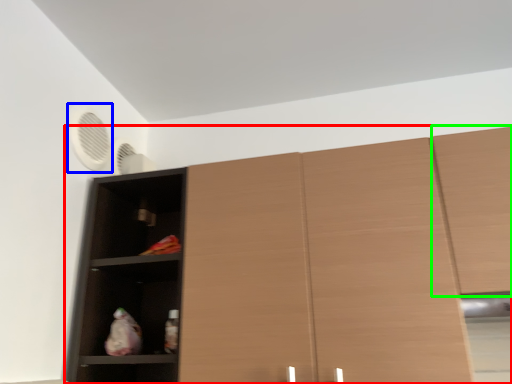
Question: Based on their relative distances, which object is farther from cupboard (highlighted by a red box)? Choose from fan (highlighted by a blue box) and cabinetry (highlighted by a green box).

Choices:
 (A) fan
 (B) cabinetry

Answer: (A)